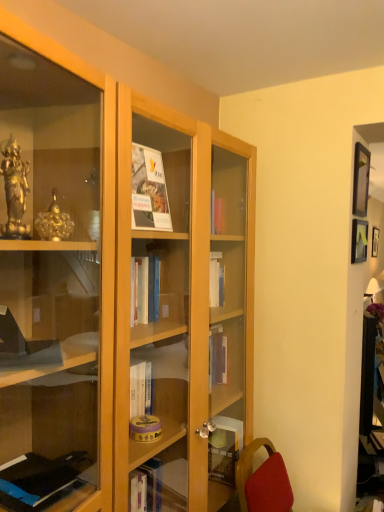
The width and height of the screenshot is (384, 512). Describe the element at coordinates (361, 180) in the screenshot. I see `matte black picture frame at upper right, arranged as the second picture frame when ordered from the bottom` at that location.

The image size is (384, 512). In order to click on matte black picture frame at upper right, the first picture frame viewed from the top in this screenshot , I will do click(x=361, y=180).

You are a GUI agent. You are given a task and a screenshot of the screen. Output one action in this format:
    pyautogui.click(x=<x>, y=<y>)
    Task: Click on the matte black picture frame at upper right, which is the 2th picture frame in top-to-bottom order
    The height and width of the screenshot is (512, 384).
    Given the screenshot: What is the action you would take?
    pyautogui.click(x=359, y=241)

How much space does matte black picture frame at upper right, the 1th picture frame ordered from the bottom, occupy horizontally?

matte black picture frame at upper right, the 1th picture frame ordered from the bottom, is 1.46 inches in width.

What do you see at coordinates (359, 241) in the screenshot?
I see `matte black picture frame at upper right, which is the 2th picture frame in top-to-bottom order` at bounding box center [359, 241].

Where is `matte black picture frame at upper right, the first picture frame viewed from the top`? The image size is (384, 512). matte black picture frame at upper right, the first picture frame viewed from the top is located at coordinates (361, 180).

Considering the relative positions of matte black picture frame at upper right, which is the 2th picture frame in top-to-bottom order, and matte black picture frame at upper right, arranged as the second picture frame when ordered from the bottom, in the image provided, is matte black picture frame at upper right, which is the 2th picture frame in top-to-bottom order, to the left or to the right of matte black picture frame at upper right, arranged as the second picture frame when ordered from the bottom,?

matte black picture frame at upper right, which is the 2th picture frame in top-to-bottom order, is positioned on matte black picture frame at upper right, arranged as the second picture frame when ordered from the bottom,'s left side.

Considering the relative positions of matte black picture frame at upper right, the 1th picture frame ordered from the bottom, and matte black picture frame at upper right, arranged as the second picture frame when ordered from the bottom, in the image provided, is matte black picture frame at upper right, the 1th picture frame ordered from the bottom, in front of matte black picture frame at upper right, arranged as the second picture frame when ordered from the bottom,?

No, it is not.

From the picture: Which point is more forward, (354, 228) or (358, 174)?

Point (358, 174)

From the image's perspective, is matte black picture frame at upper right, the 1th picture frame ordered from the bottom, located above or below matte black picture frame at upper right, the first picture frame viewed from the top?

Based on their image positions, matte black picture frame at upper right, the 1th picture frame ordered from the bottom, is located beneath matte black picture frame at upper right, the first picture frame viewed from the top.

Looking at this image, from a real-world perspective, between matte black picture frame at upper right, the 1th picture frame ordered from the bottom, and matte black picture frame at upper right, arranged as the second picture frame when ordered from the bottom, who is vertically higher?

In real-world perspective, matte black picture frame at upper right, arranged as the second picture frame when ordered from the bottom, is above.

Considering the sizes of objects matte black picture frame at upper right, which is the 2th picture frame in top-to-bottom order, and matte black picture frame at upper right, arranged as the second picture frame when ordered from the bottom, in the image provided, who is thinner, matte black picture frame at upper right, which is the 2th picture frame in top-to-bottom order, or matte black picture frame at upper right, arranged as the second picture frame when ordered from the bottom,?

With smaller width is matte black picture frame at upper right, which is the 2th picture frame in top-to-bottom order.

Who is shorter, matte black picture frame at upper right, which is the 2th picture frame in top-to-bottom order, or matte black picture frame at upper right, the first picture frame viewed from the top?

Standing shorter between the two is matte black picture frame at upper right, which is the 2th picture frame in top-to-bottom order.

Looking at this image, considering the sizes of objects matte black picture frame at upper right, which is the 2th picture frame in top-to-bottom order, and matte black picture frame at upper right, the first picture frame viewed from the top, in the image provided, who is smaller, matte black picture frame at upper right, which is the 2th picture frame in top-to-bottom order, or matte black picture frame at upper right, the first picture frame viewed from the top,?

matte black picture frame at upper right, which is the 2th picture frame in top-to-bottom order, is smaller.

Is matte black picture frame at upper right, arranged as the second picture frame when ordered from the bottom, a part of matte black picture frame at upper right, which is the 2th picture frame in top-to-bottom order?

No, matte black picture frame at upper right, which is the 2th picture frame in top-to-bottom order, does not contain matte black picture frame at upper right, arranged as the second picture frame when ordered from the bottom.

Is matte black picture frame at upper right, the 1th picture frame ordered from the bottom, with matte black picture frame at upper right, the first picture frame viewed from the top?

matte black picture frame at upper right, the 1th picture frame ordered from the bottom, and matte black picture frame at upper right, the first picture frame viewed from the top, are clearly separated.

Is matte black picture frame at upper right, which is the 2th picture frame in top-to-bottom order, facing away from matte black picture frame at upper right, the first picture frame viewed from the top?

No, matte black picture frame at upper right, which is the 2th picture frame in top-to-bottom order, is not facing away from matte black picture frame at upper right, the first picture frame viewed from the top.

In the scene shown: Can you tell me how much matte black picture frame at upper right, the 1th picture frame ordered from the bottom, and matte black picture frame at upper right, arranged as the second picture frame when ordered from the bottom, differ in facing direction?

0.034 degrees.

Consider the image. Measure the distance between matte black picture frame at upper right, which is the 2th picture frame in top-to-bottom order, and matte black picture frame at upper right, the first picture frame viewed from the top.

matte black picture frame at upper right, which is the 2th picture frame in top-to-bottom order, is 5.44 inches away from matte black picture frame at upper right, the first picture frame viewed from the top.

Identify the location of picture frame below the matte black picture frame at upper right, arranged as the second picture frame when ordered from the bottom (from the image's perspective). The image size is (384, 512). (359, 241).

Which is more to the right, matte black picture frame at upper right, the first picture frame viewed from the top, or matte black picture frame at upper right, the 1th picture frame ordered from the bottom?

Positioned to the right is matte black picture frame at upper right, the first picture frame viewed from the top.

Considering the relative positions of matte black picture frame at upper right, arranged as the second picture frame when ordered from the bottom, and matte black picture frame at upper right, which is the 2th picture frame in top-to-bottom order, in the image provided, is matte black picture frame at upper right, arranged as the second picture frame when ordered from the bottom, behind matte black picture frame at upper right, which is the 2th picture frame in top-to-bottom order,?

That is False.

Does point (359, 183) appear closer or farther from the camera than point (359, 243)?

Clearly, point (359, 183) is closer to the camera than point (359, 243).

From the image's perspective, is matte black picture frame at upper right, arranged as the second picture frame when ordered from the bottom, located beneath matte black picture frame at upper right, which is the 2th picture frame in top-to-bottom order?

Actually, matte black picture frame at upper right, arranged as the second picture frame when ordered from the bottom, appears above matte black picture frame at upper right, which is the 2th picture frame in top-to-bottom order, in the image.

From a real-world perspective, which is physically below, matte black picture frame at upper right, the first picture frame viewed from the top, or matte black picture frame at upper right, which is the 2th picture frame in top-to-bottom order?

In real-world perspective, matte black picture frame at upper right, which is the 2th picture frame in top-to-bottom order, is lower.

Which object is wider, matte black picture frame at upper right, arranged as the second picture frame when ordered from the bottom, or matte black picture frame at upper right, which is the 2th picture frame in top-to-bottom order?

matte black picture frame at upper right, arranged as the second picture frame when ordered from the bottom, is wider.

Considering the relative sizes of matte black picture frame at upper right, arranged as the second picture frame when ordered from the bottom, and matte black picture frame at upper right, which is the 2th picture frame in top-to-bottom order, in the image provided, is matte black picture frame at upper right, arranged as the second picture frame when ordered from the bottom, taller than matte black picture frame at upper right, which is the 2th picture frame in top-to-bottom order,?

Correct, matte black picture frame at upper right, arranged as the second picture frame when ordered from the bottom, is much taller as matte black picture frame at upper right, which is the 2th picture frame in top-to-bottom order.

Between matte black picture frame at upper right, arranged as the second picture frame when ordered from the bottom, and matte black picture frame at upper right, the 1th picture frame ordered from the bottom, which one has larger size?

matte black picture frame at upper right, arranged as the second picture frame when ordered from the bottom.

Do you think matte black picture frame at upper right, arranged as the second picture frame when ordered from the bottom, is within matte black picture frame at upper right, the 1th picture frame ordered from the bottom, or outside of it?

matte black picture frame at upper right, arranged as the second picture frame when ordered from the bottom, exists outside the volume of matte black picture frame at upper right, the 1th picture frame ordered from the bottom.

Would you say matte black picture frame at upper right, the first picture frame viewed from the top, is a long distance from matte black picture frame at upper right, the 1th picture frame ordered from the bottom?

No, matte black picture frame at upper right, the first picture frame viewed from the top, is not far from matte black picture frame at upper right, the 1th picture frame ordered from the bottom.

Is matte black picture frame at upper right, arranged as the second picture frame when ordered from the bottom, looking in the opposite direction of matte black picture frame at upper right, the 1th picture frame ordered from the bottom?

No, matte black picture frame at upper right, arranged as the second picture frame when ordered from the bottom,'s orientation is not away from matte black picture frame at upper right, the 1th picture frame ordered from the bottom.

Find the location of a particular element. The image size is (384, 512). picture frame that appears in front of the matte black picture frame at upper right, which is the 2th picture frame in top-to-bottom order is located at coordinates (361, 180).

Where is `picture frame below the matte black picture frame at upper right, the first picture frame viewed from the top (from the image's perspective)`? picture frame below the matte black picture frame at upper right, the first picture frame viewed from the top (from the image's perspective) is located at coordinates click(359, 241).

At what (x,y) coordinates should I click in order to perform the action: click on picture frame above the matte black picture frame at upper right, the 1th picture frame ordered from the bottom (from a real-world perspective). Please return your answer as a coordinate pair (x, y). This screenshot has width=384, height=512. Looking at the image, I should click on (361, 180).